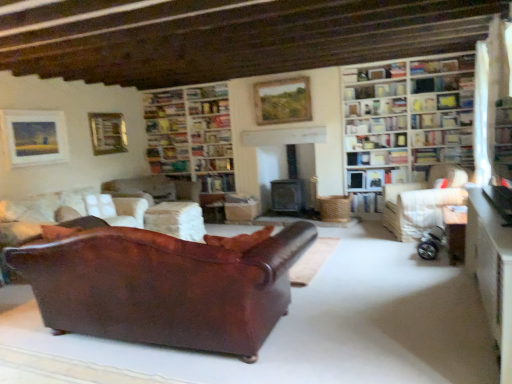
Question: Is matte white shelf at upper right, the fourth shelf positioned from the top, looking in the opposite direction of wooden table at lower right, which is the 2th table from back to front?

Choices:
 (A) no
 (B) yes

Answer: (A)

Question: From the image's perspective, is matte white shelf at upper right, which is counted as the third shelf, starting from the bottom, on top of wooden table at lower right, the 1th table in the right-to-left sequence?

Choices:
 (A) no
 (B) yes

Answer: (B)

Question: Can you confirm if matte white shelf at upper right, placed as the 1th shelf when sorted from right to left, is taller than wooden table at lower right, the 3th table viewed from the left?

Choices:
 (A) yes
 (B) no

Answer: (B)

Question: Considering the relative sizes of matte white shelf at upper right, the fourth shelf positioned from the top, and wooden table at lower right, the 3th table viewed from the left, in the image provided, is matte white shelf at upper right, the fourth shelf positioned from the top, shorter than wooden table at lower right, the 3th table viewed from the left,?

Choices:
 (A) no
 (B) yes

Answer: (B)

Question: Is matte white shelf at upper right, which appears as the 6th shelf when viewed from the left, positioned in front of wooden table at lower right, which is the 2th table from back to front?

Choices:
 (A) no
 (B) yes

Answer: (A)

Question: Does matte white shelf at upper right, placed as the 1th shelf when sorted from right to left, have a lesser width compared to wooden table at lower right, which appears as the second table when viewed from the front?

Choices:
 (A) yes
 (B) no

Answer: (B)

Question: Is hardcover book at center, the fourth book from the right, not close to wooden table at lower right, the 2th table viewed from the right?

Choices:
 (A) no
 (B) yes

Answer: (B)

Question: Considering the relative sizes of hardcover book at center, arranged as the fourth book when viewed from the top, and wooden table at lower right, marked as the first table in a front-to-back arrangement, in the image provided, is hardcover book at center, arranged as the fourth book when viewed from the top, thinner than wooden table at lower right, marked as the first table in a front-to-back arrangement,?

Choices:
 (A) yes
 (B) no

Answer: (A)

Question: Can you confirm if hardcover book at center, arranged as the fourth book when viewed from the top, is positioned to the right of wooden table at lower right, the 2th table viewed from the right?

Choices:
 (A) no
 (B) yes

Answer: (A)

Question: Does hardcover book at center, which appears as the 2th book when ordered from the bottom, have a lesser height compared to wooden table at lower right, the 3th table in the back-to-front sequence?

Choices:
 (A) yes
 (B) no

Answer: (A)

Question: From a real-world perspective, is hardcover book at center, placed as the 2th book when sorted from left to right, physically above wooden table at lower right, the second table in the left-to-right sequence?

Choices:
 (A) no
 (B) yes

Answer: (B)

Question: Considering the relative positions of hardcover book at center, the fourth book from the right, and wooden table at lower right, the 2th table viewed from the right, in the image provided, is hardcover book at center, the fourth book from the right, behind wooden table at lower right, the 2th table viewed from the right,?

Choices:
 (A) yes
 (B) no

Answer: (A)

Question: Is white wooden bookcase at upper right, which is the 2th bookcase in back-to-front order, bigger than silver metallic baby carriage at lower right?

Choices:
 (A) yes
 (B) no

Answer: (A)